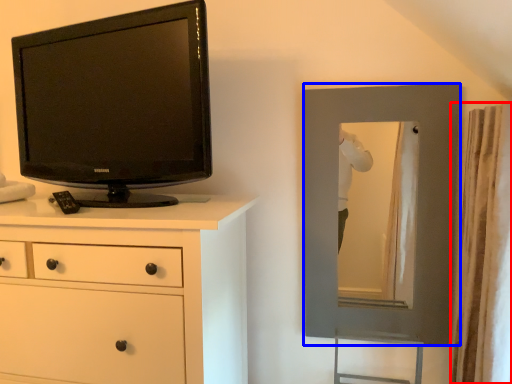
Question: Which object appears closest to the camera in this image, curtain (highlighted by a red box) or picture frame (highlighted by a blue box)?

Choices:
 (A) curtain
 (B) picture frame

Answer: (A)